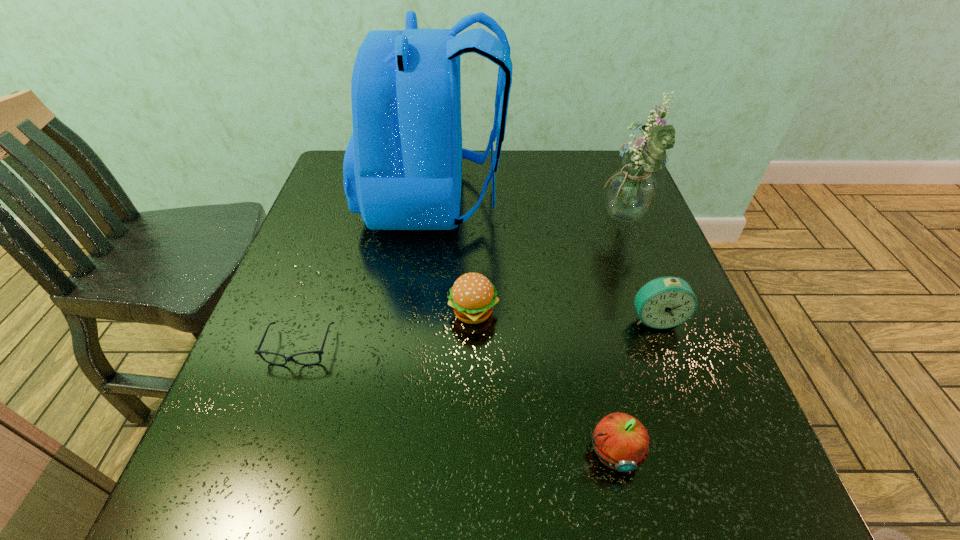
You are a GUI agent. You are given a task and a screenshot of the screen. Output one action in this format:
    pyautogui.click(x=<x>, y=<y>)
    Task: Click on the vacant region between the shortest object and the backpack
    The image size is (960, 540).
    Given the screenshot: What is the action you would take?
    pyautogui.click(x=367, y=274)

This screenshot has width=960, height=540. Identify the location of free spot between the bouquet and the third tallest object. [640, 270].

The height and width of the screenshot is (540, 960). I want to click on unoccupied position between the alarm clock and the tallest object, so click(x=545, y=259).

What are the coordinates of `free space that is in between the nearest object and the shortest object` in the screenshot? It's located at (456, 400).

At what (x,y) coordinates should I click in order to perform the action: click on empty space that is in between the tallest object and the apple. Please return your answer as a coordinate pair (x, y). Image resolution: width=960 pixels, height=540 pixels. Looking at the image, I should click on (523, 326).

Find the location of a particular element. This screenshot has height=540, width=960. object that is the closest one to the fourth object from left to right is located at coordinates [665, 302].

I want to click on the closest object to the hamburger, so click(402, 168).

Locate an element on the screen. vacant space that satisfies the following two spatial constraints: 1. on the back of the nearest object; 2. on the left side of the backpack is located at coordinates [402, 452].

Where is `free space that satisfies the following two spatial constraints: 1. on the back of the tallest object; 2. on the left side of the hamburger`? Image resolution: width=960 pixels, height=540 pixels. free space that satisfies the following two spatial constraints: 1. on the back of the tallest object; 2. on the left side of the hamburger is located at coordinates (420, 313).

Image resolution: width=960 pixels, height=540 pixels. I want to click on free spot that satisfies the following two spatial constraints: 1. on the front-facing side of the second tallest object; 2. on the front-facing side of the shortest object, so click(x=672, y=348).